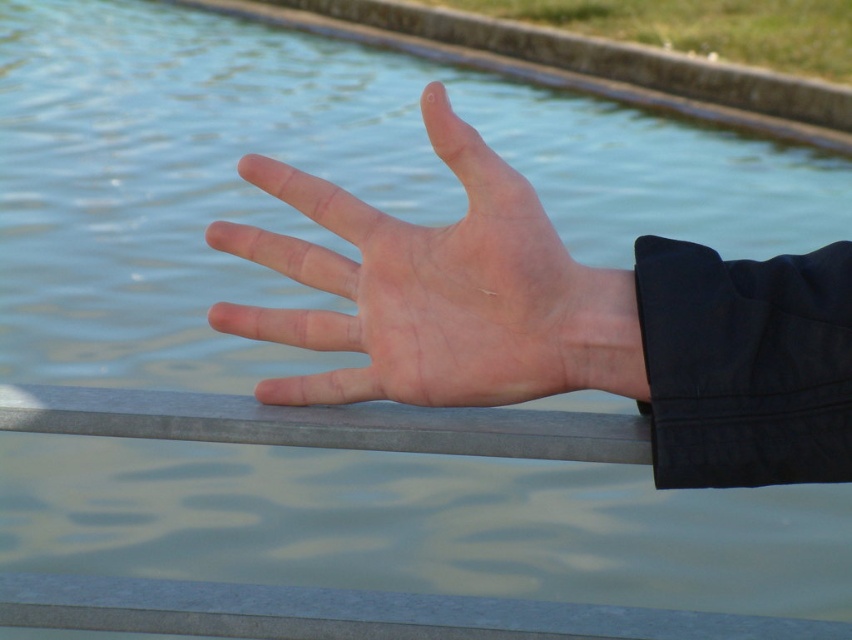
Question: Does skinny hand at center come behind pale skin hand at center?

Choices:
 (A) yes
 (B) no

Answer: (B)

Question: Is skinny hand at center to the right of pale skin hand at center from the viewer's perspective?

Choices:
 (A) no
 (B) yes

Answer: (B)

Question: Which object appears farthest from the camera in this image?

Choices:
 (A) skinny hand at center
 (B) pale skin hand at center

Answer: (B)

Question: Does skinny hand at center come behind pale skin hand at center?

Choices:
 (A) yes
 (B) no

Answer: (B)

Question: Which point is farther to the camera?

Choices:
 (A) skinny hand at center
 (B) pale skin hand at center

Answer: (B)